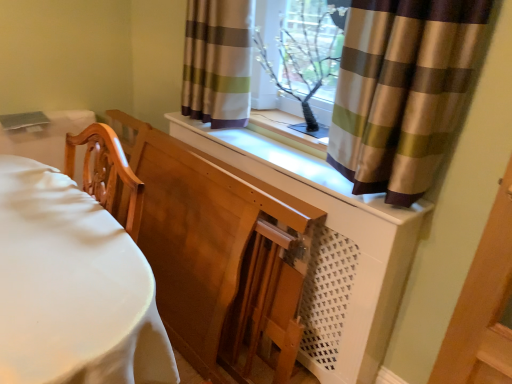
Question: From a real-world perspective, is clear glass window frame at upper center located beneath brown striped curtain at upper center, which ranks as the second curtain in left-to-right order?

Choices:
 (A) yes
 (B) no

Answer: (A)

Question: Are clear glass window frame at upper center and brown striped curtain at upper center, which is the 1th curtain from right to left, beside each other?

Choices:
 (A) yes
 (B) no

Answer: (B)

Question: From the image's perspective, does clear glass window frame at upper center appear lower than brown striped curtain at upper center, which ranks as the second curtain in left-to-right order?

Choices:
 (A) yes
 (B) no

Answer: (B)

Question: From the image's perspective, would you say clear glass window frame at upper center is positioned over brown striped curtain at upper center, the first curtain positioned from the front?

Choices:
 (A) yes
 (B) no

Answer: (A)

Question: Is clear glass window frame at upper center oriented away from brown striped curtain at upper center, which is the 1th curtain from right to left?

Choices:
 (A) yes
 (B) no

Answer: (B)

Question: From the image's perspective, is wooden chair at left above or below white matte dresser at center?

Choices:
 (A) above
 (B) below

Answer: (A)

Question: Is wooden chair at left wider or thinner than white matte dresser at center?

Choices:
 (A) wide
 (B) thin

Answer: (A)

Question: Would you say wooden chair at left is to the left or to the right of white matte dresser at center in the picture?

Choices:
 (A) right
 (B) left

Answer: (B)

Question: Considering the positions of point (37, 309) and point (326, 228), is point (37, 309) closer or farther from the camera than point (326, 228)?

Choices:
 (A) closer
 (B) farther

Answer: (A)

Question: From their relative heights in the image, would you say striped fabric curtain at upper center, arranged as the 2th curtain when viewed from the front, is taller or shorter than clear glass window frame at upper center?

Choices:
 (A) tall
 (B) short

Answer: (B)

Question: Does point (245, 91) appear closer or farther from the camera than point (259, 34)?

Choices:
 (A) farther
 (B) closer

Answer: (B)

Question: Looking at their shapes, would you say striped fabric curtain at upper center, placed as the 1th curtain when sorted from back to front, is wider or thinner than clear glass window frame at upper center?

Choices:
 (A) wide
 (B) thin

Answer: (A)

Question: Based on their positions, is striped fabric curtain at upper center, the first curtain positioned from the left, located to the left or right of clear glass window frame at upper center?

Choices:
 (A) left
 (B) right

Answer: (A)

Question: Choose the correct answer: Is wooden chair at left inside brown striped curtain at upper center, the second curtain viewed from the back, or outside it?

Choices:
 (A) outside
 (B) inside

Answer: (A)

Question: Based on their positions, is wooden chair at left located to the left or right of brown striped curtain at upper center, which ranks as the second curtain in left-to-right order?

Choices:
 (A) left
 (B) right

Answer: (A)